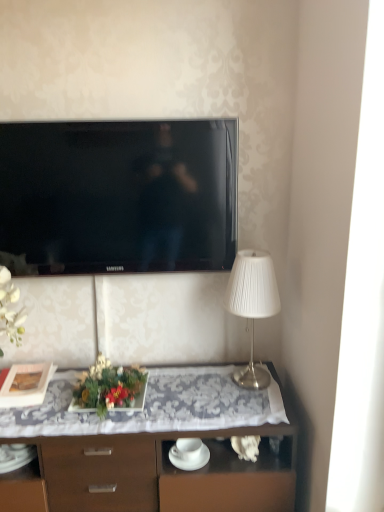
I want to click on free space above wooden desk at center (from a real-world perspective), so click(97, 403).